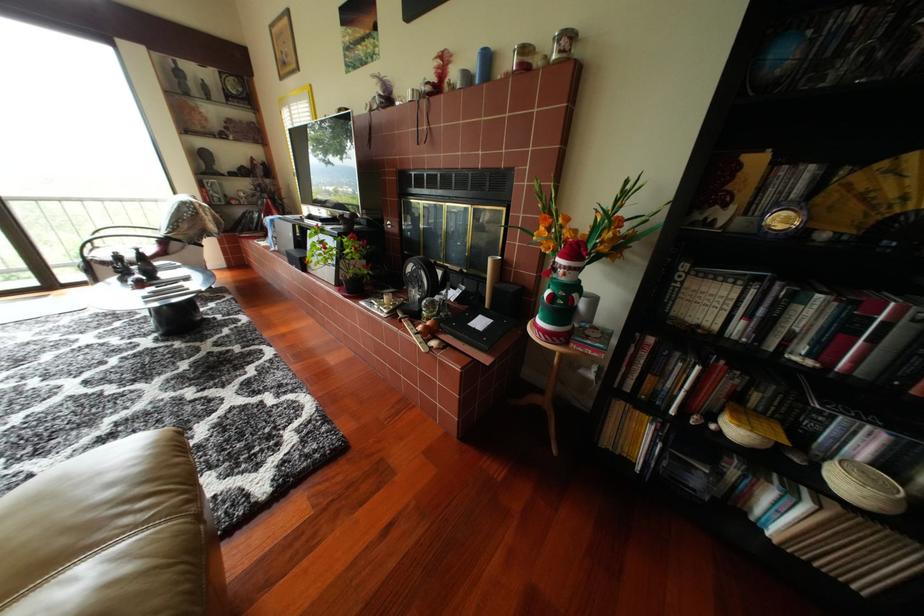
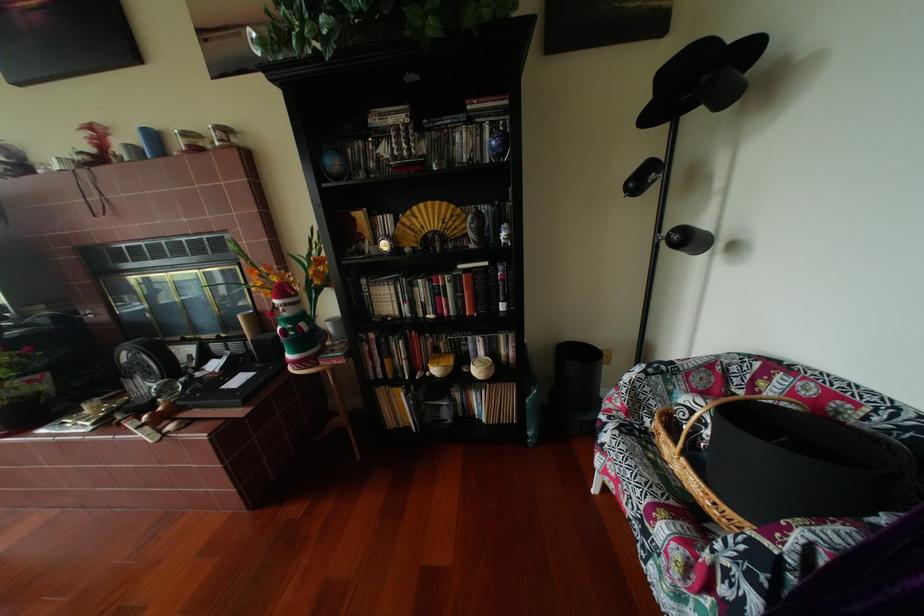
In the second image, find the point that corresponds to point 675,376 in the first image.

(404, 357)